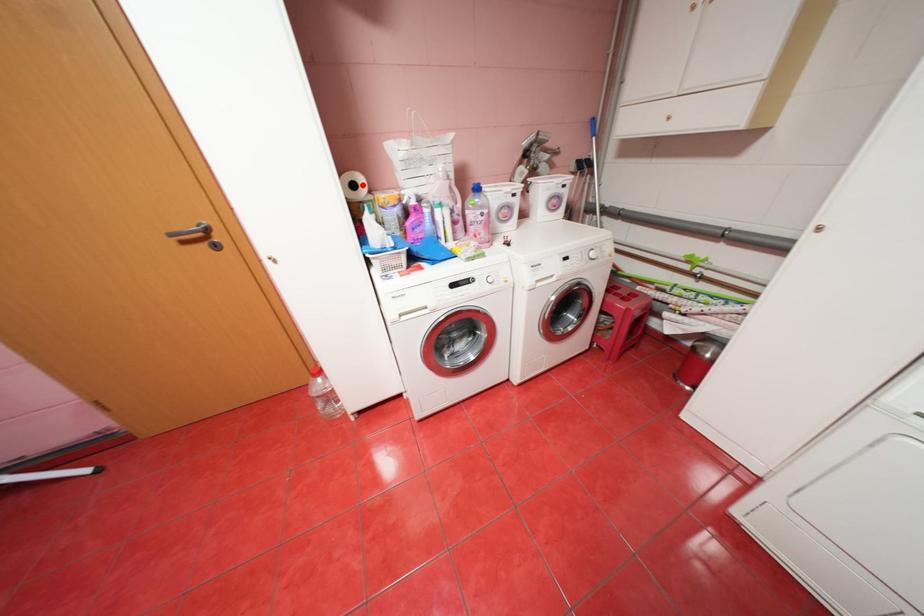
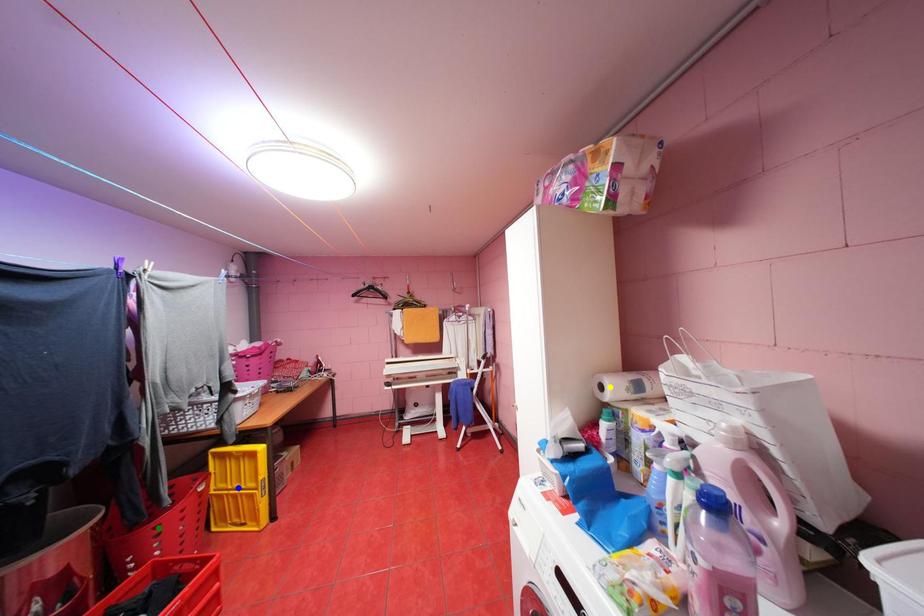
Question: I am providing you with two images of the same scene from different viewpoints. A red point is marked on the first image. You are given multiple points on the second image. Can you choose the point in image 2 that corresponds to the point in image 1?

Choices:
 (A) blue point
 (B) yellow point
 (C) green point

Answer: (B)